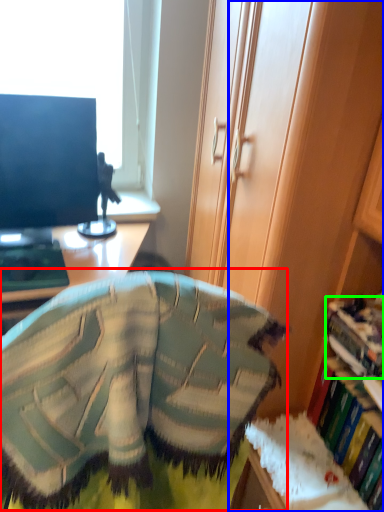
Question: Which is farther away from bean bag chair (highlighted by a red box)? cabinetry (highlighted by a blue box) or book (highlighted by a green box)?

Choices:
 (A) cabinetry
 (B) book

Answer: (B)